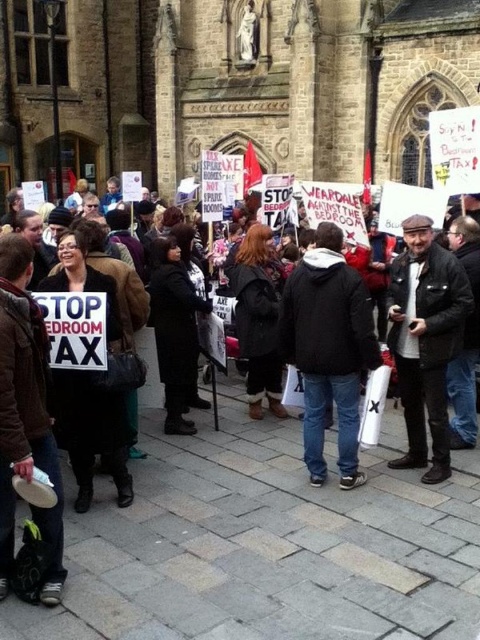
Is black leather jacket at center thinner than black leather coat at center?

No, black leather jacket at center is not thinner than black leather coat at center.

Which is in front, point (192, 636) or point (170, 314)?

Point (192, 636) is in front.

Is point (301, 554) farther from camera compared to point (192, 428)?

That is False.

Image resolution: width=480 pixels, height=640 pixels. I want to click on black leather jacket at center, so click(267, 532).

Which is in front, point (315, 285) or point (418, 449)?

Point (315, 285)

This screenshot has width=480, height=640. In order to click on dark blue jeans at center in this screenshot , I will do `click(328, 348)`.

Is point (340, 243) positioned in front of point (165, 432)?

That is True.

Does dark blue jeans at center have a greater width compared to black leather coat at center?

Correct, the width of dark blue jeans at center exceeds that of black leather coat at center.

Identify the location of dark blue jeans at center. click(x=328, y=348).

Where is `dark blue jeans at center`? Image resolution: width=480 pixels, height=640 pixels. dark blue jeans at center is located at coordinates (328, 348).